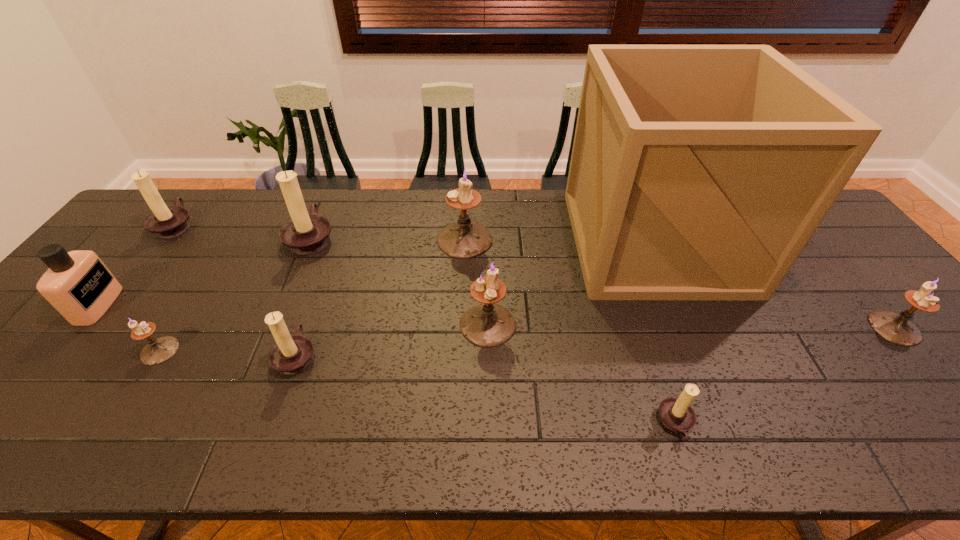
Where is `the rightmost candle holder`? The width and height of the screenshot is (960, 540). the rightmost candle holder is located at coordinates (897, 328).

Identify the location of the third object from left to right. (157, 351).

The image size is (960, 540). What are the coordinates of `the smallest purple candle holder` in the screenshot? It's located at (157, 351).

Image resolution: width=960 pixels, height=540 pixels. I want to click on the nearest brown candle holder, so click(x=676, y=414).

I want to click on the smallest brown candle holder, so click(x=676, y=414).

This screenshot has width=960, height=540. I want to click on vacant space located on the front of the brown box, so click(x=694, y=334).

Where is `free location located 0.290m on the wick of the biggest brown candle holder`? The height and width of the screenshot is (540, 960). free location located 0.290m on the wick of the biggest brown candle holder is located at coordinates (430, 237).

The width and height of the screenshot is (960, 540). Identify the location of vacant space located 0.160m on the front of the biggest purple candle holder. (463, 299).

I want to click on blank space located 0.250m on the wick of the leftmost brown candle holder, so click(x=274, y=225).

Image resolution: width=960 pixels, height=540 pixels. In order to click on vacant space situated on the front of the second biggest purple candle holder in this screenshot , I will do `click(490, 417)`.